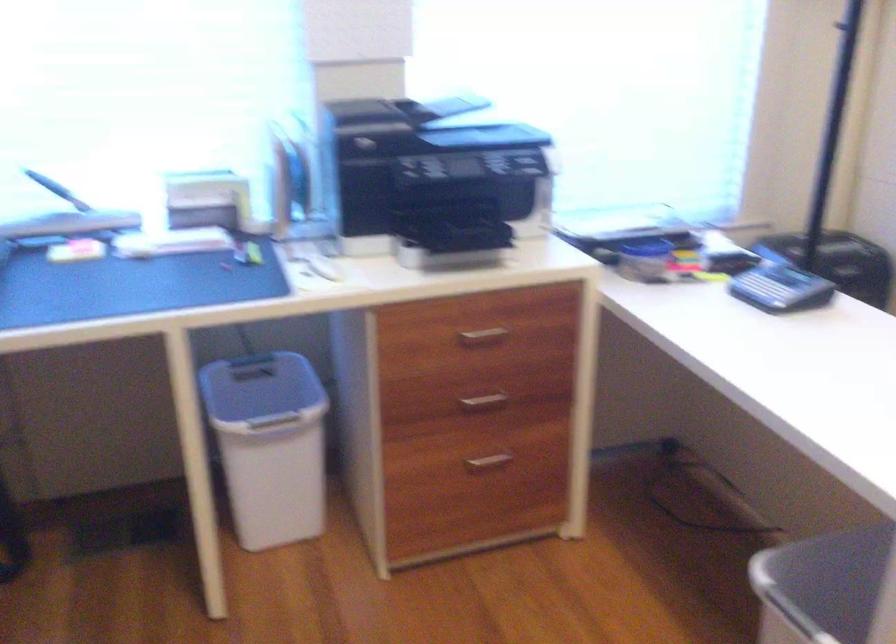
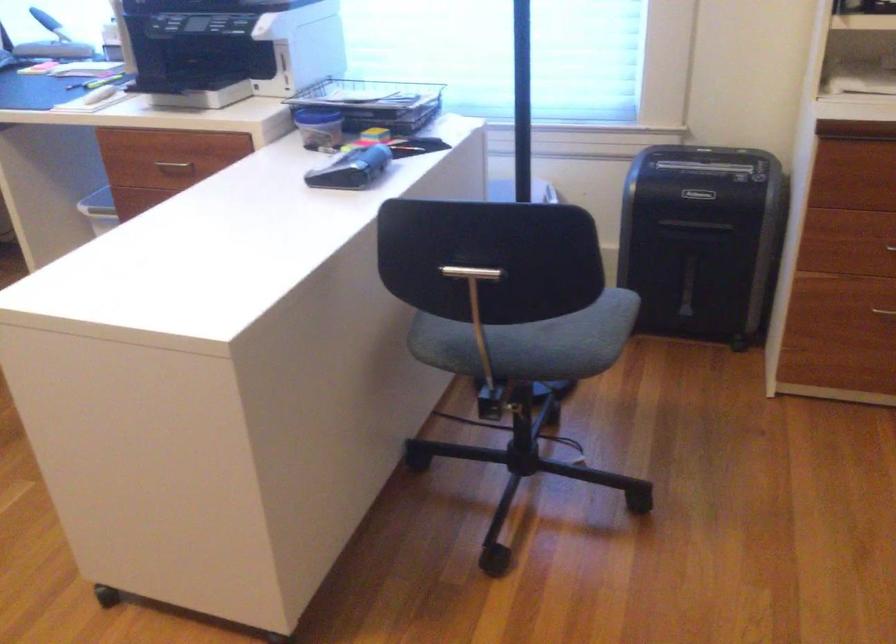
Locate, in the second image, the point that corresponds to [479,339] in the first image.

(174, 165)